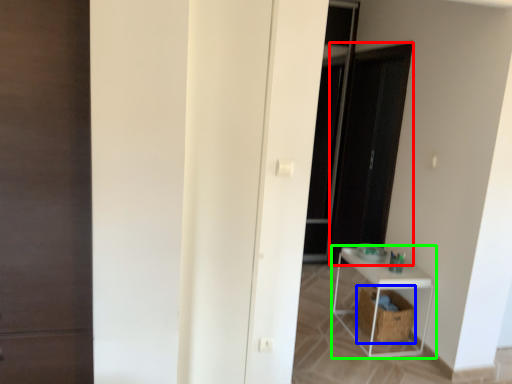
Question: Based on their relative distances, which object is nearer to screen door (highlighted by a red box)? Choose from laundry basket (highlighted by a blue box) and shelf (highlighted by a green box).

Choices:
 (A) laundry basket
 (B) shelf

Answer: (B)